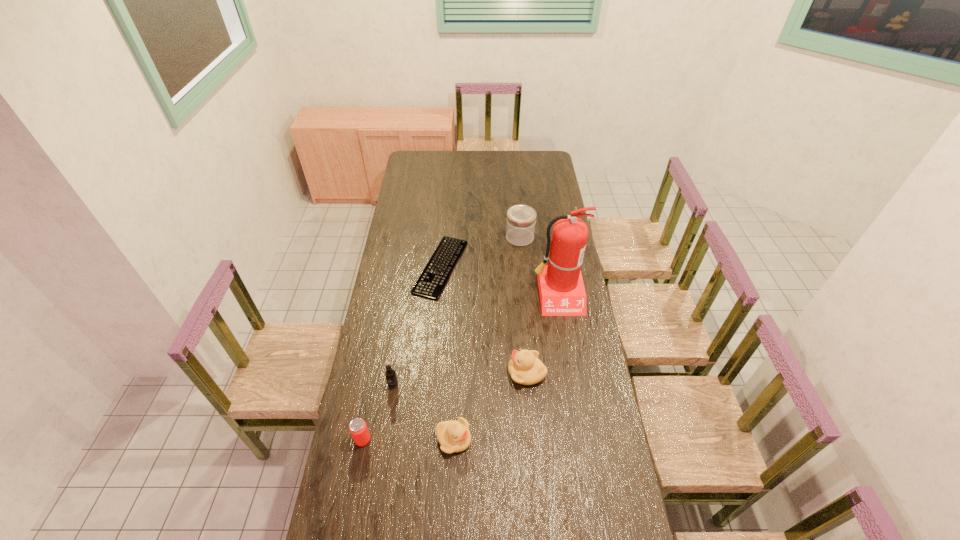
Locate an element on the screen. vacant space located on the beak of the taller duckling is located at coordinates (426, 373).

Identify the location of vacant space located on the beak of the taller duckling. The image size is (960, 540). (488, 373).

The width and height of the screenshot is (960, 540). In order to click on free space located on the beak of the taller duckling in this screenshot , I will do `click(495, 373)`.

The height and width of the screenshot is (540, 960). I want to click on free space located on the left of the jar, so click(x=488, y=237).

Image resolution: width=960 pixels, height=540 pixels. In order to click on free spot located on the label of the root beer in this screenshot , I will do `click(381, 461)`.

The height and width of the screenshot is (540, 960). I want to click on vacant space located on the back of the computer keyboard, so click(444, 228).

Locate an element on the screen. Image resolution: width=960 pixels, height=540 pixels. free space located 0.260m on the front-facing side of the tallest object is located at coordinates (569, 367).

This screenshot has height=540, width=960. What are the coordinates of `free space located 0.190m on the front of the beer can` in the screenshot? It's located at (350, 507).

The width and height of the screenshot is (960, 540). Identify the location of root beer at the left edge. (390, 374).

The width and height of the screenshot is (960, 540). Find the location of `computer keyboard that is at the left edge`. computer keyboard that is at the left edge is located at coordinates coord(432,281).